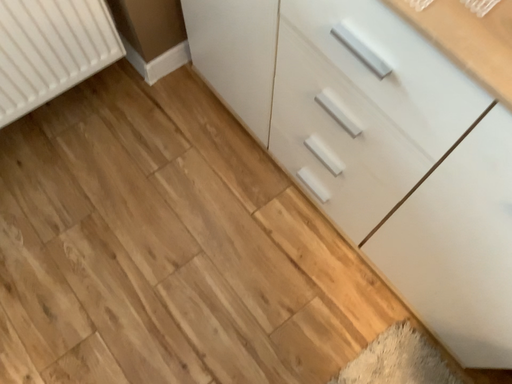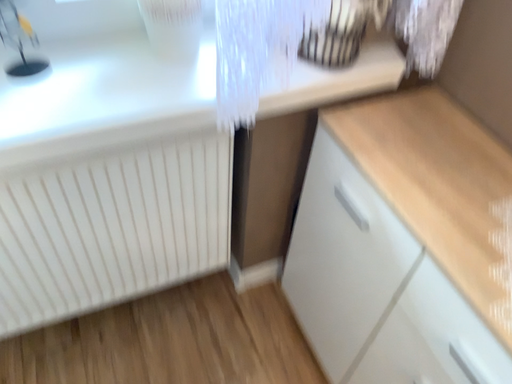
Question: Which way did the camera rotate in the video?

Choices:
 (A) rotated downward
 (B) rotated upward

Answer: (B)